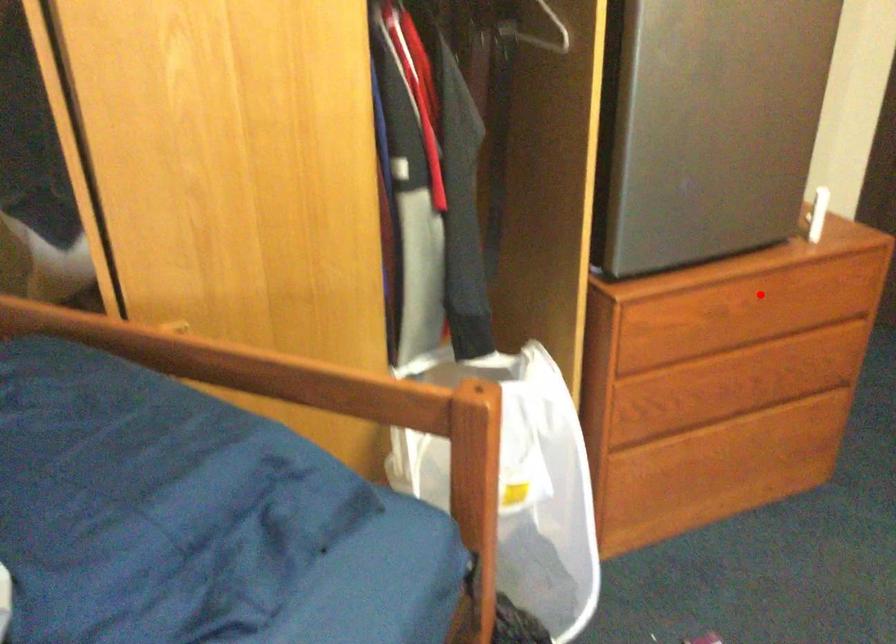
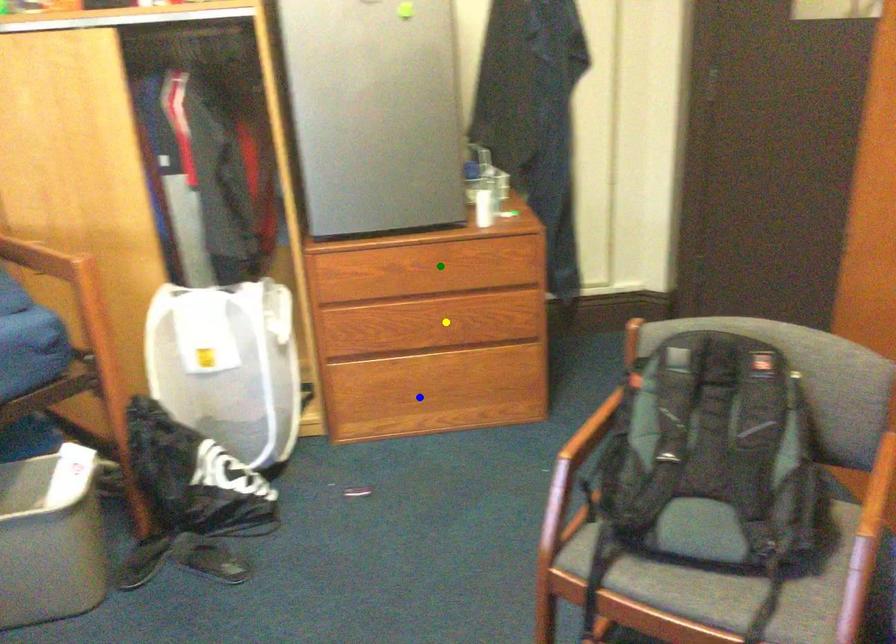
Question: I am providing you with two images of the same scene from different viewpoints. A red point is marked on the first image. You are given multiple points on the second image. Can you choose the point in image 2 that corresponds to the point in image 1?

Choices:
 (A) green point
 (B) yellow point
 (C) blue point

Answer: (A)